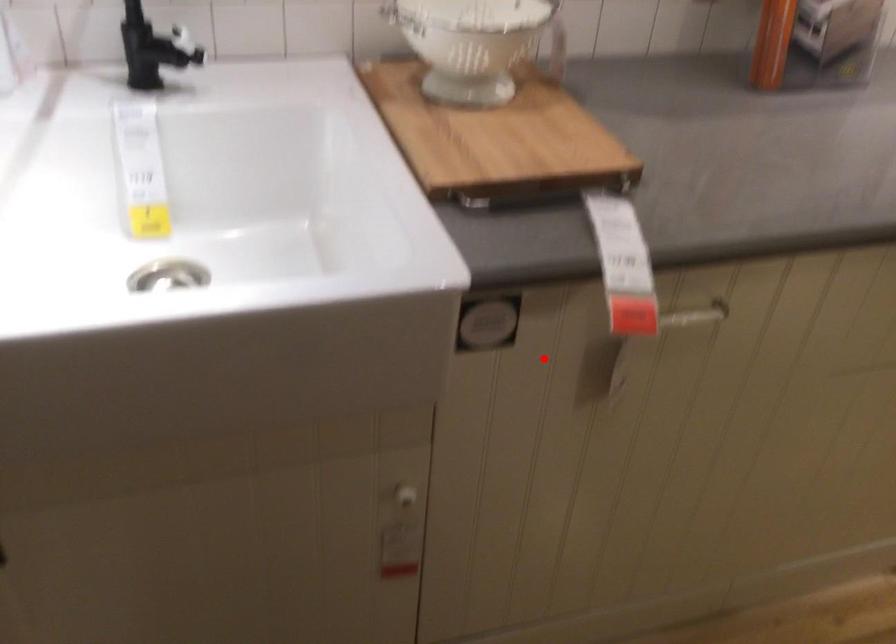
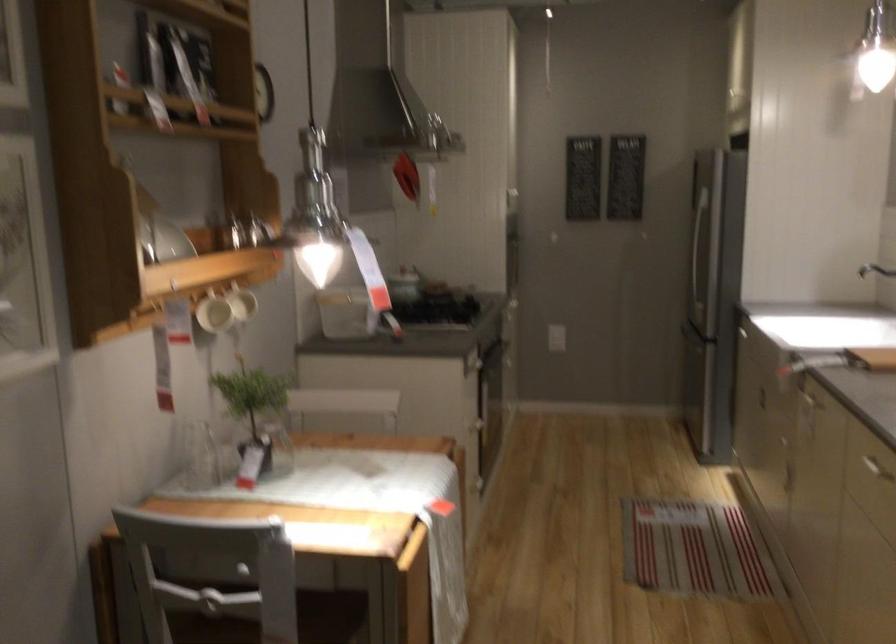
The point at the highlighted location is marked in the first image. Where is the corresponding point in the second image?

(810, 391)